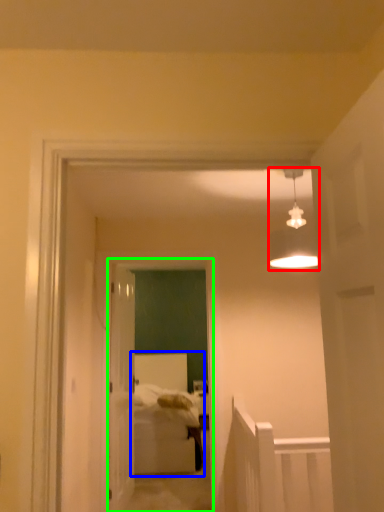
Question: Which object is the closest to the light fixture (highlighted by a red box)? Choose among these: bed (highlighted by a blue box) or glass door (highlighted by a green box).

Choices:
 (A) bed
 (B) glass door

Answer: (B)